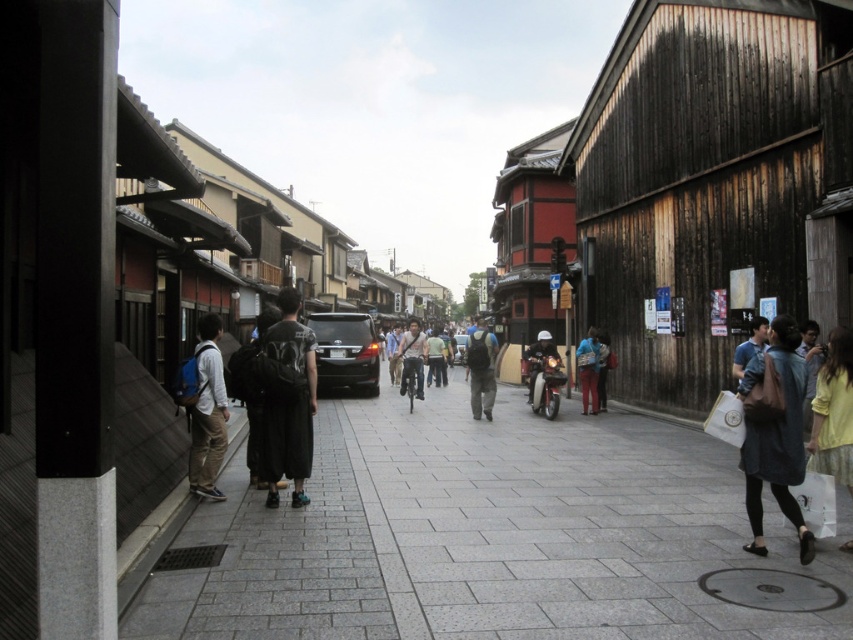
You are a photographer standing on the street and want to capture both the light brown fabric pants at left and the matte gray backpack at center in your photo. Which object should you focus on first if you want to ensure both are in sharp focus?

The light brown fabric pants at left is above the matte gray backpack at center, so focusing on the pants first would ensure both are in sharp focus as they are stacked vertically.